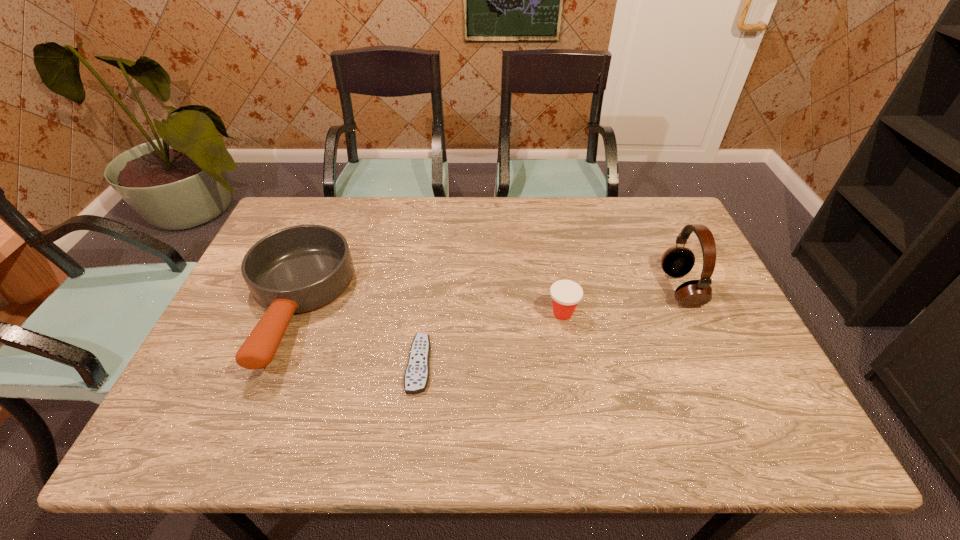
Where is `blank area located on the ear pads of the rightmost object`? blank area located on the ear pads of the rightmost object is located at coordinates (530, 289).

Where is `vacant space situated on the handle side of the leftmost object`? The height and width of the screenshot is (540, 960). vacant space situated on the handle side of the leftmost object is located at coordinates (252, 409).

At what (x,y) coordinates should I click in order to perform the action: click on vacant region located on the left of the Dixie cup. Please return your answer as a coordinate pair (x, y). Image resolution: width=960 pixels, height=540 pixels. Looking at the image, I should click on (490, 313).

At what (x,y) coordinates should I click in order to perform the action: click on free space located on the right of the remote control. Please return your answer as a coordinate pair (x, y). This screenshot has width=960, height=540. Looking at the image, I should click on (583, 364).

In order to click on object that is at the left edge in this screenshot , I will do `click(298, 269)`.

Find the location of `object situated at the right edge`. object situated at the right edge is located at coordinates (677, 261).

You are a GUI agent. You are given a task and a screenshot of the screen. Output one action in this format:
    pyautogui.click(x=<x>, y=<y>)
    Task: Click on the vacant region at the far edge of the desktop
    Image resolution: width=960 pixels, height=540 pixels.
    Given the screenshot: What is the action you would take?
    pyautogui.click(x=396, y=212)

In the image, there is a desktop. Identify the location of blank space at the near edge. (408, 433).

In the image, there is a desktop. Find the location of `vacant area at the right edge`. vacant area at the right edge is located at coordinates (772, 390).

Identify the location of free space at the far left corner of the desktop. Image resolution: width=960 pixels, height=540 pixels. (336, 199).